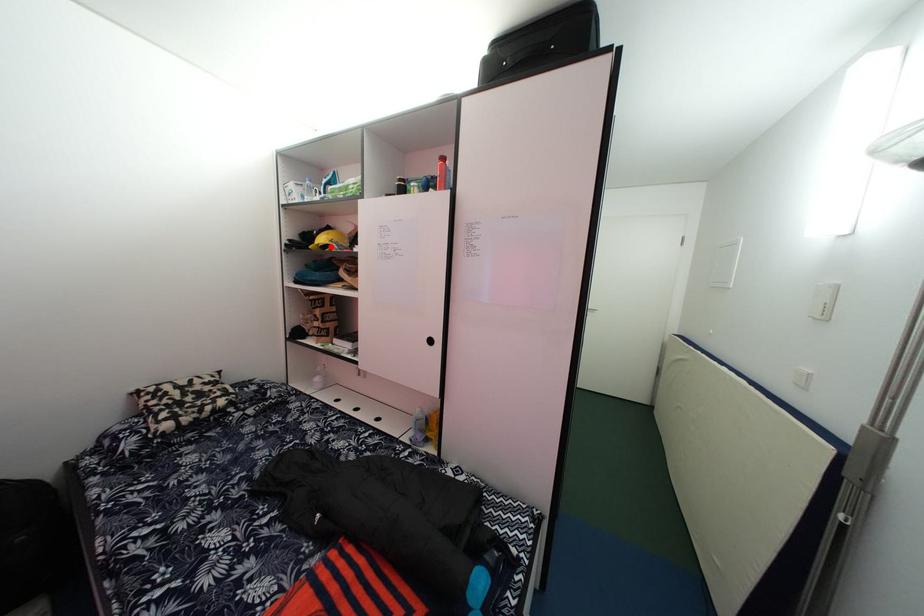
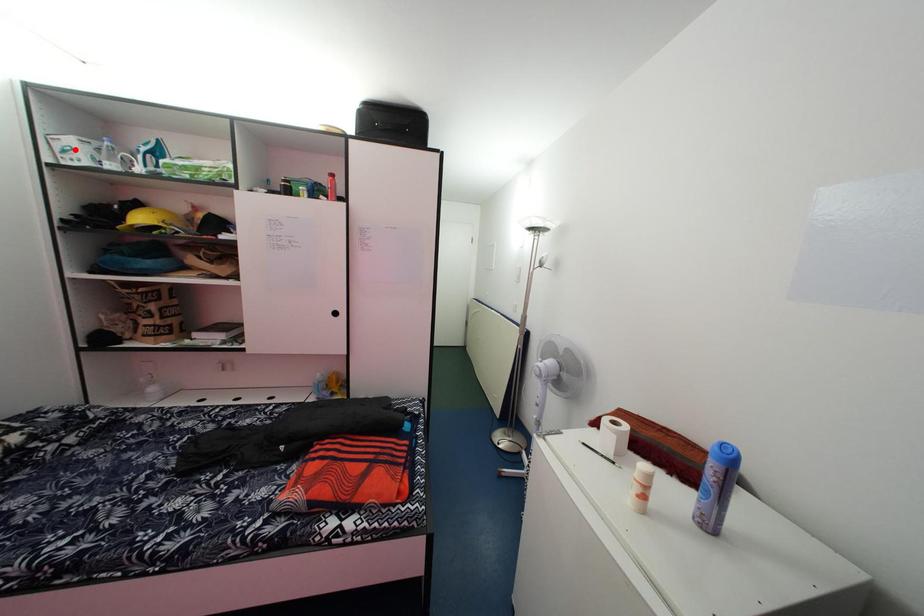
I am providing you with two images of the same scene from different viewpoints. A red point is marked on the first image and another point is marked on the second image. Is the marked point in image1 the same physical position as the marked point in image2?

No